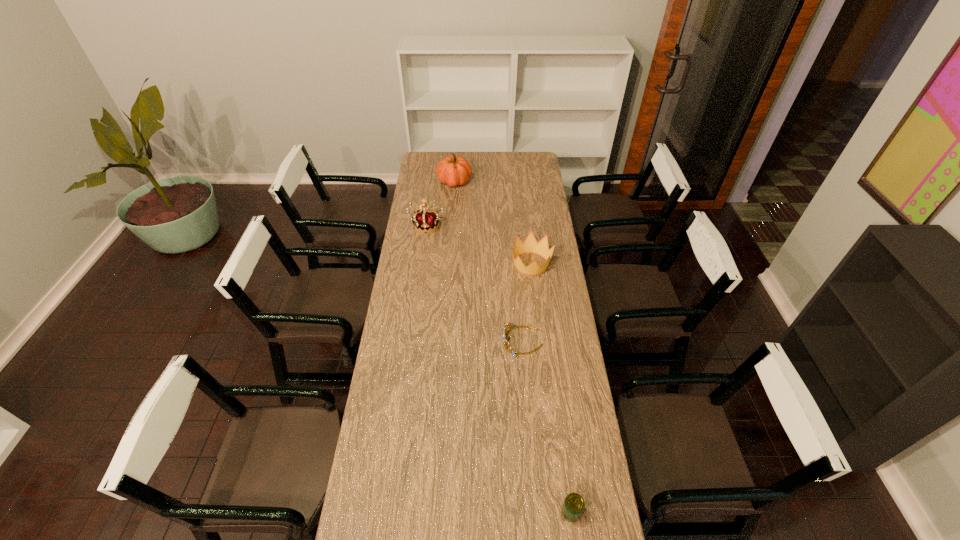
Identify the location of free point that satisfies the following two spatial constraints: 1. on the front-facing side of the third nearest object; 2. on the left side of the farther tiara. This screenshot has height=540, width=960. (421, 264).

Find the location of a particular element. This screenshot has width=960, height=540. free space that satisfies the following two spatial constraints: 1. on the front-facing side of the beer can; 2. on the right side of the taller tiara is located at coordinates (389, 512).

Where is `vacant region that satisfies the following two spatial constraints: 1. on the back side of the beer can; 2. on the front-facing side of the second nearest object`? vacant region that satisfies the following two spatial constraints: 1. on the back side of the beer can; 2. on the front-facing side of the second nearest object is located at coordinates (548, 341).

Identify the location of vacant space that satisfies the following two spatial constraints: 1. on the front-facing side of the nearest object; 2. on the right side of the right tiara. The width and height of the screenshot is (960, 540). click(537, 512).